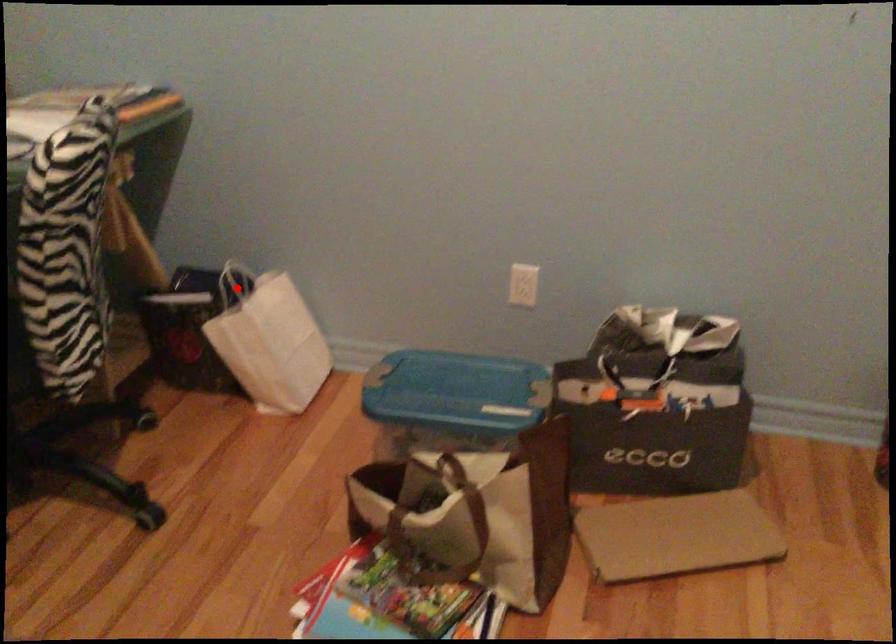
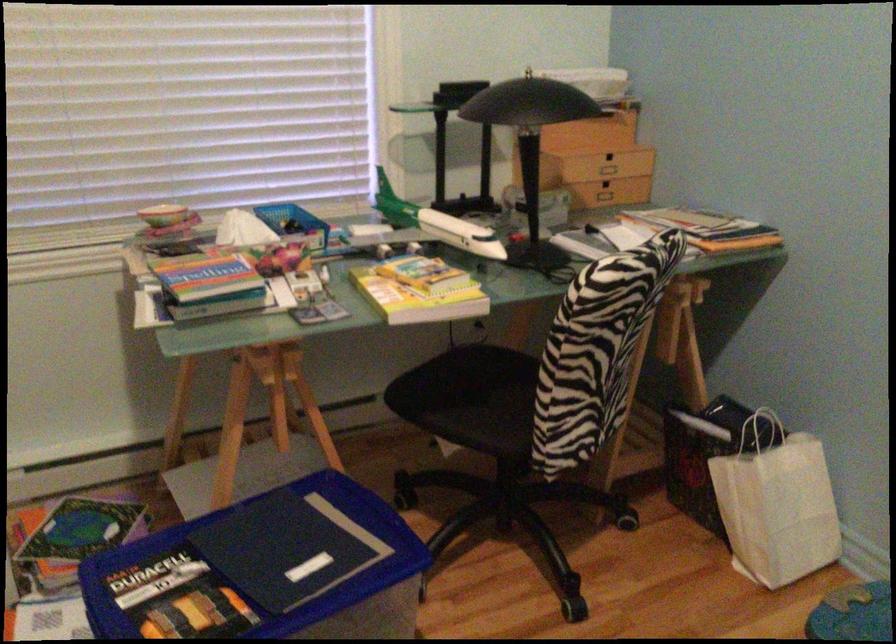
In the second image, find the point that corresponds to the highlighted location in the first image.

(761, 431)